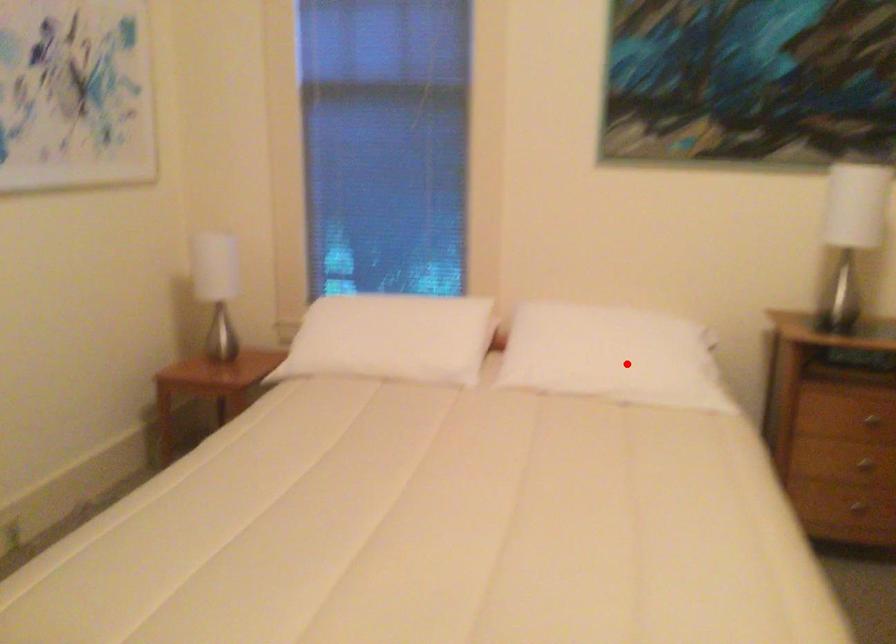
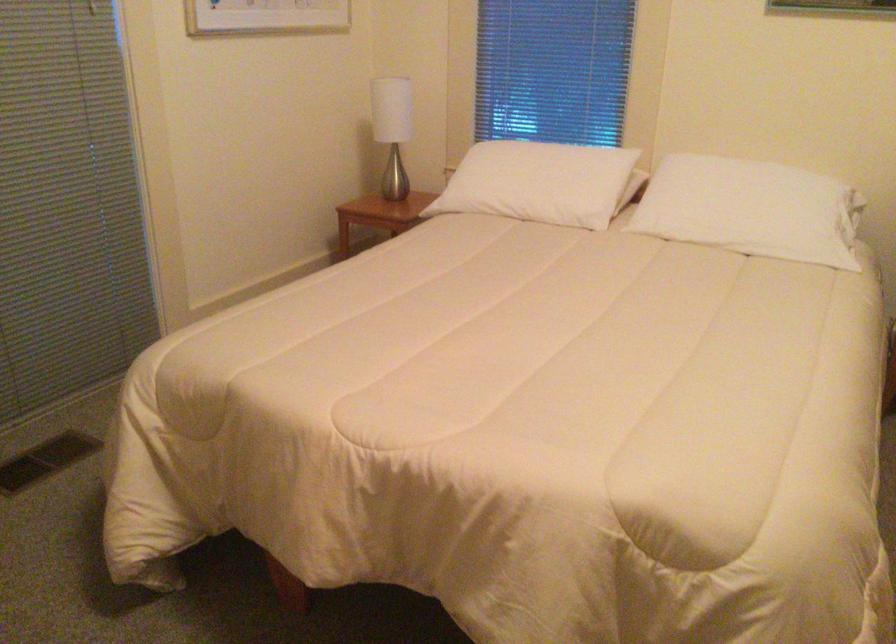
Question: I am providing you with two images of the same scene from different viewpoints. A red point is marked on the first image. Can you still see the location of the red point in image 2?

Choices:
 (A) Yes
 (B) No

Answer: (A)